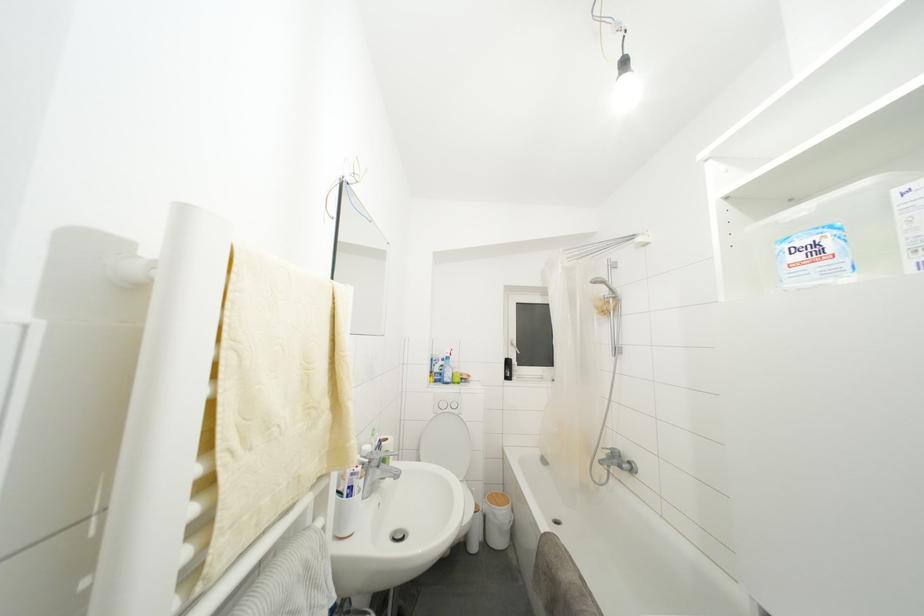
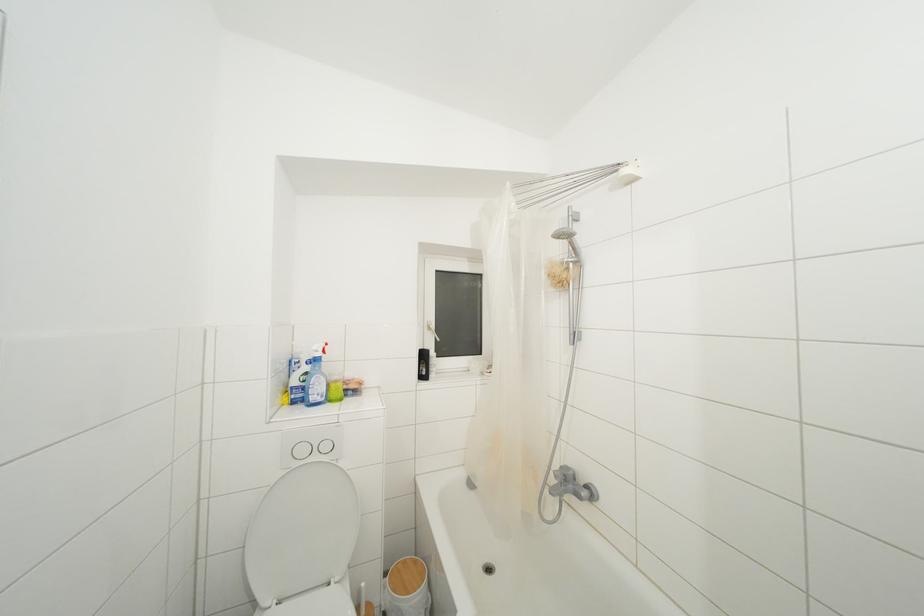
In the second image, find the point that corresponds to pixel 454 415 in the first image.

(320, 463)